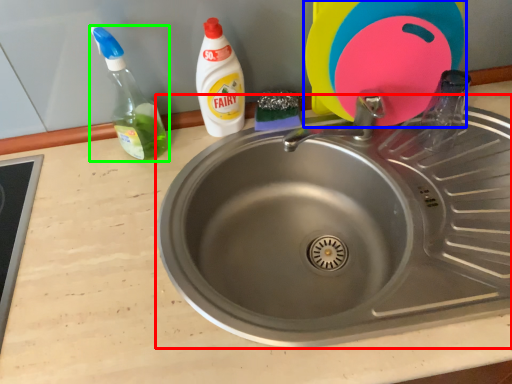
Question: Considering the real-world distances, which object is closest to sink (highlighted by a red box)? toy (highlighted by a blue box) or bottle (highlighted by a green box).

Choices:
 (A) toy
 (B) bottle

Answer: (A)